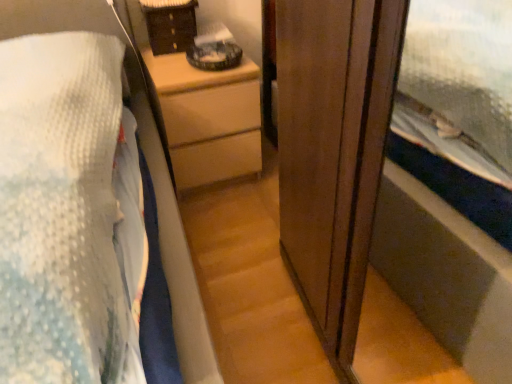
In order to face wooden chest of drawers at center, should I rotate leftwards or rightwards?

A 7.455 degree turn to the left will do.

The height and width of the screenshot is (384, 512). Describe the element at coordinates (208, 119) in the screenshot. I see `wooden chest of drawers at center` at that location.

Find the location of a particular element. The width and height of the screenshot is (512, 384). wooden chest of drawers at center is located at coordinates (208, 119).

Where is `brown woven basket at upper center`? brown woven basket at upper center is located at coordinates (170, 24).

Describe the element at coordinates (170, 24) in the screenshot. I see `brown woven basket at upper center` at that location.

What is the approximate width of brown woven basket at upper center?

The width of brown woven basket at upper center is 7.91 inches.

The width and height of the screenshot is (512, 384). I want to click on wooden chest of drawers at center, so click(208, 119).

Between wooden chest of drawers at center and brown woven basket at upper center, which one appears on the right side from the viewer's perspective?

From the viewer's perspective, wooden chest of drawers at center appears more on the right side.

Which object is further away from the camera taking this photo, wooden chest of drawers at center or brown woven basket at upper center?

brown woven basket at upper center is further from the camera.

Is point (212, 124) positioned behind point (170, 24)?

Yes, it is.

From the image's perspective, is wooden chest of drawers at center positioned above or below brown woven basket at upper center?

Clearly, from the image's perspective, wooden chest of drawers at center is below brown woven basket at upper center.

From a real-world perspective, relative to brown woven basket at upper center, is wooden chest of drawers at center vertically above or below?

In terms of real-world spatial position, wooden chest of drawers at center is below brown woven basket at upper center.

Which object is thinner, wooden chest of drawers at center or brown woven basket at upper center?

brown woven basket at upper center.

Which of these two, wooden chest of drawers at center or brown woven basket at upper center, stands shorter?

Standing shorter between the two is brown woven basket at upper center.

Who is smaller, wooden chest of drawers at center or brown woven basket at upper center?

brown woven basket at upper center.

Is wooden chest of drawers at center not within brown woven basket at upper center?

Absolutely, wooden chest of drawers at center is external to brown woven basket at upper center.

Would you say wooden chest of drawers at center is a long distance from brown woven basket at upper center?

No.

Could you tell me if wooden chest of drawers at center is facing brown woven basket at upper center?

No, wooden chest of drawers at center is not aimed at brown woven basket at upper center.

What's the angular difference between wooden chest of drawers at center and brown woven basket at upper center's facing directions?

There is a 2.57-degree angle between the facing directions of wooden chest of drawers at center and brown woven basket at upper center.

Locate an element on the screen. Image resolution: width=512 pixels, height=384 pixels. the chest of drawers that appears below the brown woven basket at upper center (from the image's perspective) is located at coordinates (208, 119).

Is brown woven basket at upper center to the left or to the right of wooden chest of drawers at center in the image?

In the image, brown woven basket at upper center appears on the left side of wooden chest of drawers at center.

Is brown woven basket at upper center in front of or behind wooden chest of drawers at center in the image?

In the image, brown woven basket at upper center appears behind wooden chest of drawers at center.

Considering the positions of points (175, 35) and (232, 160), is point (175, 35) farther from camera compared to point (232, 160)?

No.

From the image's perspective, relative to wooden chest of drawers at center, is brown woven basket at upper center above or below?

Clearly, from the image's perspective, brown woven basket at upper center is above wooden chest of drawers at center.

From a real-world perspective, which is physically above, brown woven basket at upper center or wooden chest of drawers at center?

brown woven basket at upper center is physically above.

Does brown woven basket at upper center have a greater width compared to wooden chest of drawers at center?

Incorrect, the width of brown woven basket at upper center does not surpass that of wooden chest of drawers at center.

From their relative heights in the image, would you say brown woven basket at upper center is taller or shorter than wooden chest of drawers at center?

In the image, brown woven basket at upper center appears to be shorter than wooden chest of drawers at center.

Based on the photo, can you confirm if brown woven basket at upper center is smaller than wooden chest of drawers at center?

Correct, brown woven basket at upper center occupies less space than wooden chest of drawers at center.

In the scene shown: Is brown woven basket at upper center surrounding wooden chest of drawers at center?

Actually, wooden chest of drawers at center is outside brown woven basket at upper center.

Is brown woven basket at upper center not near wooden chest of drawers at center?

No, there isn't a large distance between brown woven basket at upper center and wooden chest of drawers at center.

Based on the photo, does brown woven basket at upper center turn towards wooden chest of drawers at center?

No, brown woven basket at upper center is not turned towards wooden chest of drawers at center.

How different are the orientations of brown woven basket at upper center and wooden chest of drawers at center in degrees?

The angle between the facing direction of brown woven basket at upper center and the facing direction of wooden chest of drawers at center is 2.57 degrees.

Measure the distance between brown woven basket at upper center and wooden chest of drawers at center.

A distance of 11.44 inches exists between brown woven basket at upper center and wooden chest of drawers at center.

Where is `cabinetry that appears on the left of wooden chest of drawers at center`? The image size is (512, 384). cabinetry that appears on the left of wooden chest of drawers at center is located at coordinates (170, 24).

The width and height of the screenshot is (512, 384). In order to click on chest of drawers on the right of the brown woven basket at upper center in this screenshot , I will do `click(208, 119)`.

Image resolution: width=512 pixels, height=384 pixels. What are the coordinates of `the chest of drawers that is under the brown woven basket at upper center (from a real-world perspective)` in the screenshot? It's located at (208, 119).